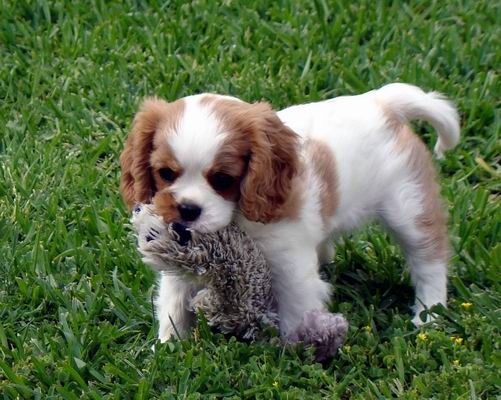
You are a GUI agent. You are given a task and a screenshot of the screen. Output one action in this format:
    pyautogui.click(x=<x>, y=<y>)
    Task: Click on the toy
    The image size is (501, 400).
    Given the screenshot: What is the action you would take?
    pyautogui.click(x=245, y=288)